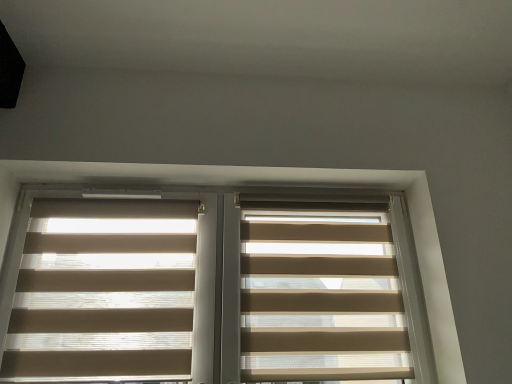
Question: Should I look upward or downward to see beige translucent blinds at left, positioned as the 1th window blind in left-to-right order?

Choices:
 (A) down
 (B) up

Answer: (A)

Question: Does beige fabric blinds at center, marked as the 2th window blind in a left-to-right arrangement, have a lesser height compared to beige translucent blinds at center?

Choices:
 (A) yes
 (B) no

Answer: (A)

Question: Does beige fabric blinds at center, marked as the 2th window blind in a left-to-right arrangement, lie behind beige translucent blinds at center?

Choices:
 (A) yes
 (B) no

Answer: (A)

Question: Is beige translucent blinds at center surrounded by beige fabric blinds at center, the first window blind in the right-to-left sequence?

Choices:
 (A) yes
 (B) no

Answer: (B)

Question: Is beige fabric blinds at center, the first window blind in the right-to-left sequence, to the right of beige translucent blinds at center from the viewer's perspective?

Choices:
 (A) no
 (B) yes

Answer: (B)

Question: Is beige fabric blinds at center, marked as the 2th window blind in a left-to-right arrangement, at the left side of beige translucent blinds at center?

Choices:
 (A) yes
 (B) no

Answer: (B)

Question: Is beige fabric blinds at center, marked as the 2th window blind in a left-to-right arrangement, far from beige translucent blinds at center?

Choices:
 (A) no
 (B) yes

Answer: (A)

Question: Is beige fabric blinds at center, the first window blind in the right-to-left sequence, inside beige translucent blinds at left, positioned as the 1th window blind in left-to-right order?

Choices:
 (A) yes
 (B) no

Answer: (B)

Question: From a real-world perspective, is beige translucent blinds at left, positioned as the 1th window blind in left-to-right order, on beige fabric blinds at center, the first window blind in the right-to-left sequence?

Choices:
 (A) no
 (B) yes

Answer: (B)

Question: Could you tell me if beige translucent blinds at left, positioned as the 1th window blind in left-to-right order, is facing beige fabric blinds at center, marked as the 2th window blind in a left-to-right arrangement?

Choices:
 (A) no
 (B) yes

Answer: (A)

Question: From the image's perspective, is beige translucent blinds at left, acting as the second window blind starting from the right, located above beige fabric blinds at center, the first window blind in the right-to-left sequence?

Choices:
 (A) no
 (B) yes

Answer: (B)

Question: Does beige translucent blinds at left, acting as the second window blind starting from the right, have a lesser width compared to beige fabric blinds at center, the first window blind in the right-to-left sequence?

Choices:
 (A) yes
 (B) no

Answer: (A)

Question: From the image's perspective, is beige translucent blinds at left, positioned as the 1th window blind in left-to-right order, below beige fabric blinds at center, marked as the 2th window blind in a left-to-right arrangement?

Choices:
 (A) yes
 (B) no

Answer: (B)

Question: Is beige translucent blinds at center further to camera compared to beige fabric blinds at center, marked as the 2th window blind in a left-to-right arrangement?

Choices:
 (A) yes
 (B) no

Answer: (B)